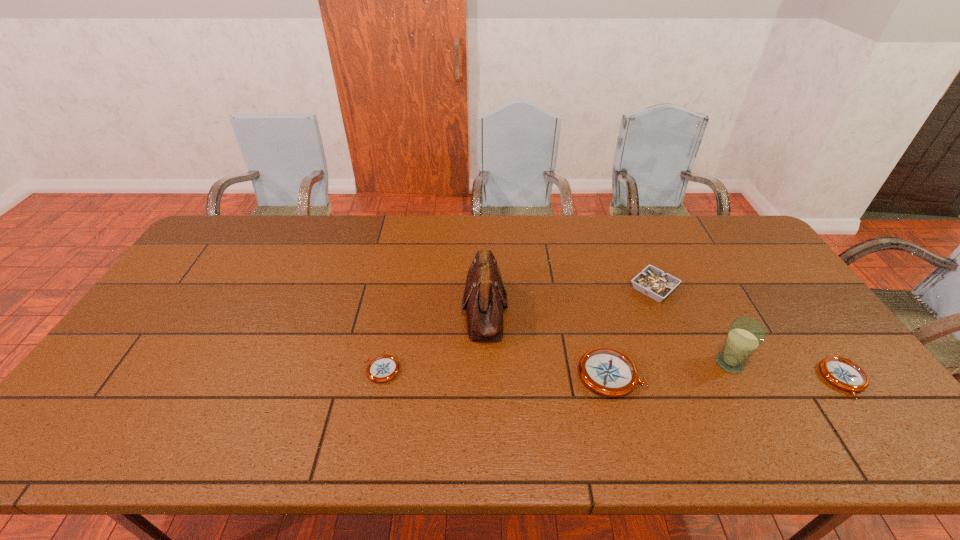
In the current image, all compasss are evenly spaced. To maintain this equal spacing, where should an additional compass be placed on the left? Please point out a free spot. Please provide its 2D coordinates. Your answer should be formatted as a tuple, i.e. [(x, y)], where the tuple contains the x and y coordinates of a point satisfying the conditions above.

[(157, 366)]